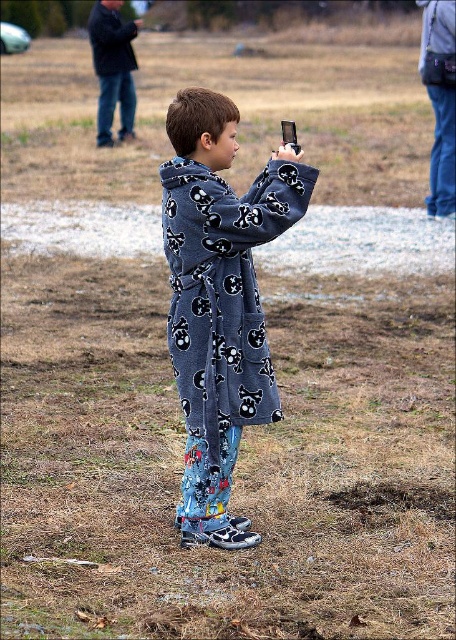
Is dark gray fleece robe at upper left shorter than metallic silver phone at upper center?

Correct, dark gray fleece robe at upper left is not as tall as metallic silver phone at upper center.

What do you see at coordinates (113, 68) in the screenshot?
I see `dark gray fleece robe at upper left` at bounding box center [113, 68].

Who is more forward, (88, 35) or (289, 124)?

Point (289, 124) is more forward.

Locate an element on the screen. dark gray fleece robe at upper left is located at coordinates (113, 68).

Who is more forward, (233, 522) or (290, 141)?

Point (290, 141)

Who is positioned more to the left, flannel fleece jacket at center or metallic silver phone at upper center?

flannel fleece jacket at center is more to the left.

Is point (239, 230) farther from viewer compared to point (284, 134)?

No, it is in front of (284, 134).

Where is `flannel fleece jacket at center`? The width and height of the screenshot is (456, 640). flannel fleece jacket at center is located at coordinates tap(219, 300).

Which is behind, point (221, 310) or point (130, 116)?

The point (130, 116) is more distant.

Who is more forward, (x=221, y=444) or (x=130, y=22)?

Positioned in front is point (x=221, y=444).

Identify the location of flannel fleece jacket at center. (219, 300).